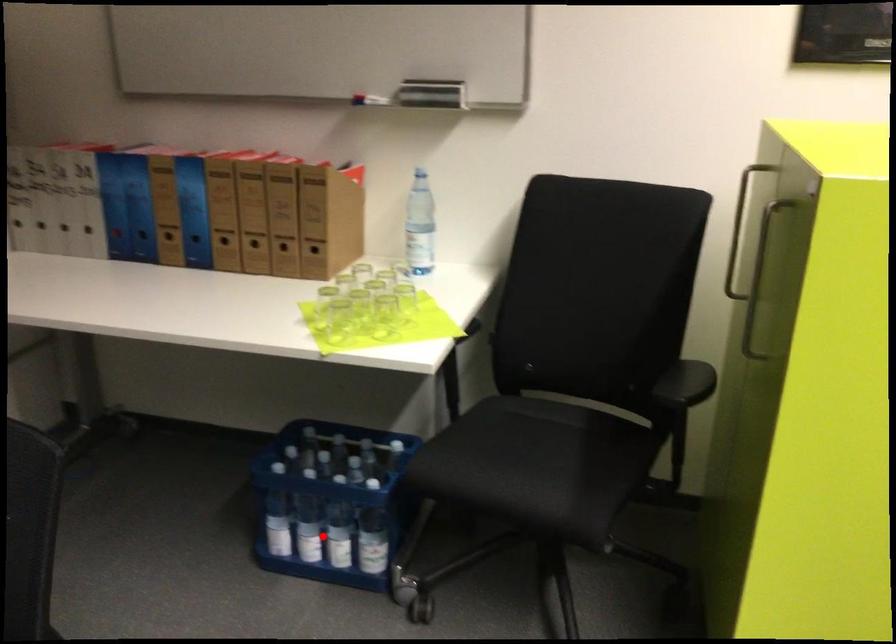
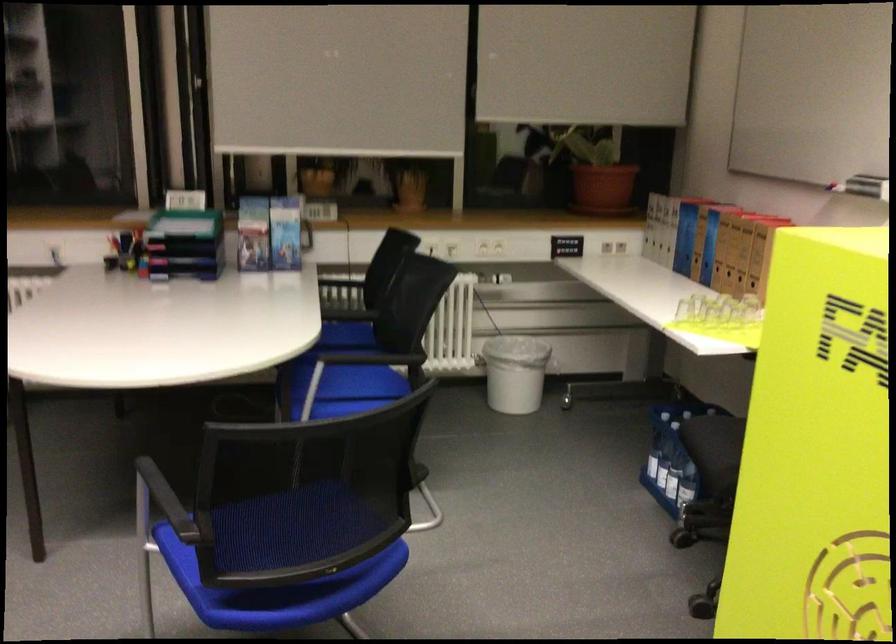
Question: I am providing you with two images of the same scene from different viewpoints. Image1 has a red point marked. In image2, the corresponding 3D location appears at what relative position? Reply with the corresponding letter.

Choices:
 (A) Closer
 (B) Farther

Answer: (B)